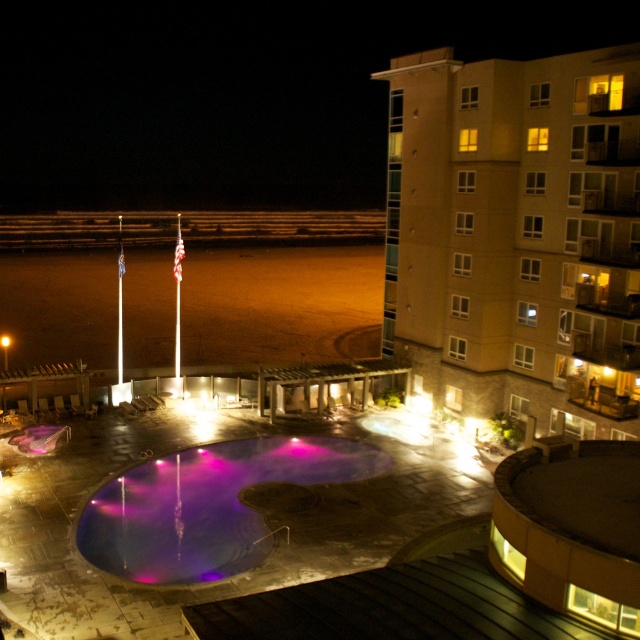
You are standing at the edge of the purple reflective pool at center and want to walk towards the beige concrete building at upper right. Which direction should you head to reach it?

The beige concrete building at upper right is located to the right side of the purple reflective pool at center. You should head towards the right direction to reach it.

You are standing at the edge of the purple reflective pool at center and want to take a photo of the beige concrete building at upper right. Which direction should you face to capture both the building and the pool in your shot?

You should face to the right side of the purple reflective pool at center to include both the beige concrete building at upper right and the pool in your photo, since the building is positioned on the right side of the pool.

You are standing at the edge of the purple reflective pool at center and want to look up at the beige concrete building at upper right. Will the building be visible in the pool?

The beige concrete building at upper right is positioned over the purple reflective pool at center, so its reflection would be visible in the pool.